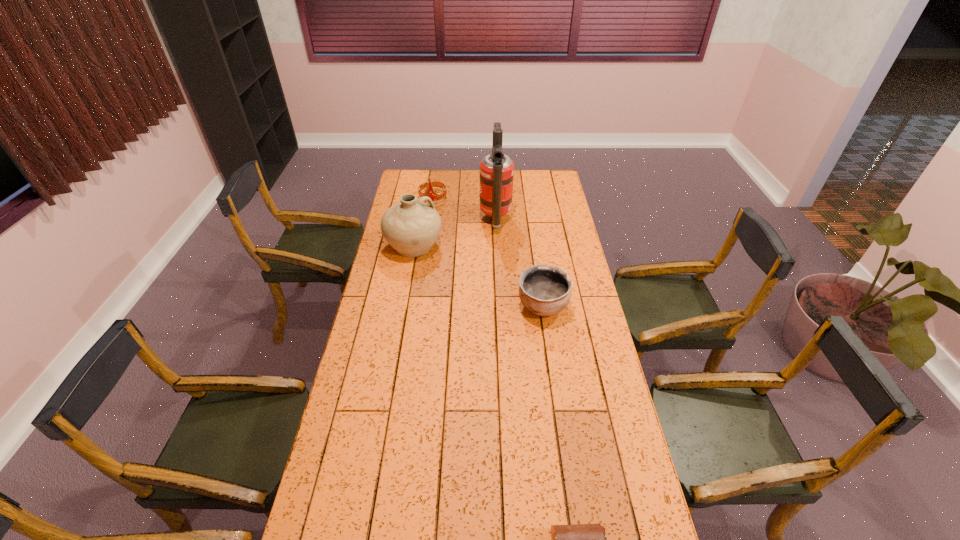
At what (x,y) coordinates should I click in order to perform the action: click on the tallest object. Please return your answer as a coordinate pair (x, y). This screenshot has height=540, width=960. Looking at the image, I should click on (496, 173).

I want to click on the left pottery, so click(x=411, y=227).

Locate an element on the screen. The height and width of the screenshot is (540, 960). the taller pottery is located at coordinates (411, 227).

This screenshot has height=540, width=960. I want to click on the third tallest object, so click(434, 196).

Find the location of a particular element. This screenshot has height=540, width=960. the nearer pottery is located at coordinates (545, 290).

You are a GUI agent. You are given a task and a screenshot of the screen. Output one action in this format:
    pyautogui.click(x=<x>, y=<y>)
    Task: Click on the shorter pottery
    This screenshot has height=540, width=960.
    Given the screenshot: What is the action you would take?
    pyautogui.click(x=545, y=290)

This screenshot has height=540, width=960. I want to click on free region located 0.300m on the front label side of the fire extinguisher, so click(419, 220).

The width and height of the screenshot is (960, 540). In order to click on vacant space located 0.330m on the front label side of the fire extinguisher in this screenshot , I will do `click(413, 220)`.

This screenshot has width=960, height=540. I want to click on vacant position located on the front label side of the fire extinguisher, so click(x=466, y=220).

The height and width of the screenshot is (540, 960). Identify the location of vacant space located 0.080m on the front of the taller pottery. (408, 276).